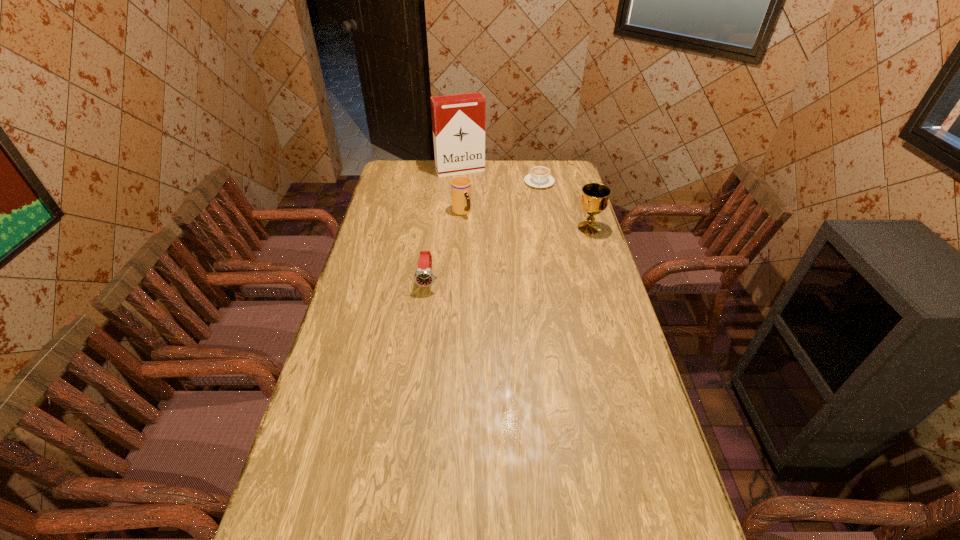
Find the location of a particular element. cappuccino that is at the far edge is located at coordinates (540, 177).

Image resolution: width=960 pixels, height=540 pixels. What are the coordinates of `cigarette_case located in the far edge section of the desktop` in the screenshot? It's located at (458, 121).

The height and width of the screenshot is (540, 960). I want to click on chalice at the right edge, so click(x=594, y=200).

Identify the location of cappuccino at the right edge. This screenshot has width=960, height=540. (540, 177).

Find the location of a particular element. Image resolution: width=960 pixels, height=540 pixels. object that is at the far right corner is located at coordinates (540, 177).

In the image, there is a desktop. Identify the location of vacant area at the near edge. 446,529.

Where is `vacant space at the left edge of the desktop`? Image resolution: width=960 pixels, height=540 pixels. vacant space at the left edge of the desktop is located at coordinates (306, 418).

The height and width of the screenshot is (540, 960). In the image, there is a desktop. Find the location of `vacant region at the right edge`. vacant region at the right edge is located at coordinates (620, 416).

The width and height of the screenshot is (960, 540). What are the coordinates of `vacant space at the far left corner of the desktop` in the screenshot? It's located at (415, 179).

Image resolution: width=960 pixels, height=540 pixels. I want to click on free space between the nearest object and the shortest object, so point(484,232).